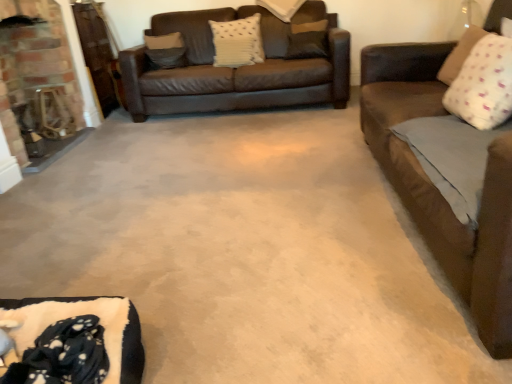
Locate an element on the screen. This screenshot has width=512, height=384. suede-like beige pillow at upper left, which is the 6th pillow from right to left is located at coordinates click(x=166, y=50).

You are a GUI agent. You are given a task and a screenshot of the screen. Output one action in this format:
    pyautogui.click(x=<x>, y=<y>)
    Task: Click on the brown fabric pillow at upper center, the fourth pillow when ordered from left to right
    
    Given the screenshot: What is the action you would take?
    click(308, 40)

Measure the distance between brown fabric pillow at upper center, the fourth pillow from the front, and camera.

The depth of brown fabric pillow at upper center, the fourth pillow from the front, is 11.60 feet.

Where is `white dotted pillow at upper right, the 6th pillow positioned from the left`? white dotted pillow at upper right, the 6th pillow positioned from the left is located at coordinates (460, 54).

What do you see at coordinates (63, 55) in the screenshot? I see `brick fireplace at left` at bounding box center [63, 55].

This screenshot has width=512, height=384. What do you see at coordinates (132, 350) in the screenshot?
I see `black fleece blanket at lower left` at bounding box center [132, 350].

You are a GUI agent. You are given a task and a screenshot of the screen. Output one action in this format:
    pyautogui.click(x=<x>, y=<y>)
    Task: Click on the suede-like beige pillow at upper left, which is the 6th pillow from right to left
    The image size is (512, 384).
    Given the screenshot: What is the action you would take?
    pyautogui.click(x=166, y=50)

Between white soft pillow at upper right, which ranks as the 1th pillow in front-to-back order, and white dotted pillow at upper right, marked as the 5th pillow in a back-to-front arrangement, which one has more height?

With more height is white soft pillow at upper right, which ranks as the 1th pillow in front-to-back order.

Is white soft pillow at upper right, acting as the 6th pillow starting from the back, turned away from white dotted pillow at upper right, marked as the 5th pillow in a back-to-front arrangement?

That's not correct — white soft pillow at upper right, acting as the 6th pillow starting from the back, is not looking away from white dotted pillow at upper right, marked as the 5th pillow in a back-to-front arrangement.

Is the position of white soft pillow at upper right, which ranks as the 2th pillow in right-to-left order, more distant than that of white dotted pillow at upper right, the 6th pillow positioned from the left?

No.

Based on their sizes in the image, would you say white soft pillow at upper right, the fifth pillow positioned from the left, is bigger or smaller than white dotted pillow at upper right, acting as the second pillow starting from the front?

Clearly, white soft pillow at upper right, the fifth pillow positioned from the left, is larger in size than white dotted pillow at upper right, acting as the second pillow starting from the front.

Is white textured pillow at upper center, the fourth pillow viewed from the right, at the right side of suede-like beige pillow at upper left, the 6th pillow viewed from the front?

Yes, white textured pillow at upper center, the fourth pillow viewed from the right, is to the right of suede-like beige pillow at upper left, the 6th pillow viewed from the front.

How many degrees apart are the facing directions of white textured pillow at upper center, arranged as the 2th pillow when viewed from the back, and suede-like beige pillow at upper left, which is the first pillow from back to front?

8.65 degrees.

Is white textured pillow at upper center, the third pillow viewed from the left, beside suede-like beige pillow at upper left, which is the 6th pillow from right to left?

No, white textured pillow at upper center, the third pillow viewed from the left, is not next to suede-like beige pillow at upper left, which is the 6th pillow from right to left.

From the image's perspective, would you say white textured pillow at upper center, the third pillow viewed from the left, is positioned over suede-like beige pillow at upper left, which is the 6th pillow from right to left?

Yes.

Is there a large distance between brick fireplace at left and white textured pillow at center, positioned as the fourth pillow in back-to-front order?

brick fireplace at left is far away from white textured pillow at center, positioned as the fourth pillow in back-to-front order.

At what (x,y) coordinates should I click in order to perform the action: click on the 2nd pillow to the right of the brick fireplace at left, starting your count from the anchor. Please return your answer as a coordinate pair (x, y). The image size is (512, 384). Looking at the image, I should click on (237, 42).

Between point (42, 81) and point (244, 19), which one is positioned behind?

The point (244, 19) is more distant.

Do you think brick fireplace at left is within white textured pillow at center, the 3th pillow viewed from the front, or outside of it?

brick fireplace at left exists outside the volume of white textured pillow at center, the 3th pillow viewed from the front.

Considering the positions of objects white dotted pillow at upper right, the 6th pillow positioned from the left, and black fleece blanket at lower left in the image provided, who is behind, white dotted pillow at upper right, the 6th pillow positioned from the left, or black fleece blanket at lower left?

white dotted pillow at upper right, the 6th pillow positioned from the left, is further from the camera.

Who is shorter, white dotted pillow at upper right, acting as the second pillow starting from the front, or black fleece blanket at lower left?

Standing shorter between the two is black fleece blanket at lower left.

How distant is white dotted pillow at upper right, acting as the second pillow starting from the front, from black fleece blanket at lower left?

They are 2.15 meters apart.

Does point (469, 31) lie behind point (136, 380)?

That is True.

From the image's perspective, is white soft pillow at upper right, which ranks as the 2th pillow in right-to-left order, above brown fabric pillow at upper center, which appears as the third pillow when viewed from the right?

Incorrect, from the image's perspective, white soft pillow at upper right, which ranks as the 2th pillow in right-to-left order, is lower than brown fabric pillow at upper center, which appears as the third pillow when viewed from the right.

Considering the relative sizes of white soft pillow at upper right, acting as the 6th pillow starting from the back, and brown fabric pillow at upper center, which is counted as the 3th pillow, starting from the back, in the image provided, is white soft pillow at upper right, acting as the 6th pillow starting from the back, smaller than brown fabric pillow at upper center, which is counted as the 3th pillow, starting from the back,?

Actually, white soft pillow at upper right, acting as the 6th pillow starting from the back, might be larger than brown fabric pillow at upper center, which is counted as the 3th pillow, starting from the back.

From the image's perspective, which pillow is the 3rd one below the brown fabric pillow at upper center, which appears as the third pillow when viewed from the right? Please provide its 2D coordinates.

[(483, 84)]

From a real-world perspective, which object rests below the other?

white soft pillow at upper right, which ranks as the 1th pillow in front-to-back order, is physically lower.

From a real-world perspective, is suede-like beige pillow at upper left, acting as the 1th pillow starting from the left, located higher than white soft pillow at upper right, which ranks as the 1th pillow in front-to-back order?

Actually, suede-like beige pillow at upper left, acting as the 1th pillow starting from the left, is physically below white soft pillow at upper right, which ranks as the 1th pillow in front-to-back order, in the real world.

In the scene shown: Which object is positioned more to the right, suede-like beige pillow at upper left, which is the first pillow from back to front, or white soft pillow at upper right, which ranks as the 1th pillow in front-to-back order?

Positioned to the right is white soft pillow at upper right, which ranks as the 1th pillow in front-to-back order.

Where is `the 5th pillow in front of the suede-like beige pillow at upper left, the 6th pillow viewed from the front`? the 5th pillow in front of the suede-like beige pillow at upper left, the 6th pillow viewed from the front is located at coordinates (483, 84).

Considering the relative sizes of suede-like beige pillow at upper left, which is the 6th pillow from right to left, and white soft pillow at upper right, which ranks as the 2th pillow in right-to-left order, in the image provided, is suede-like beige pillow at upper left, which is the 6th pillow from right to left, shorter than white soft pillow at upper right, which ranks as the 2th pillow in right-to-left order,?

Yes, suede-like beige pillow at upper left, which is the 6th pillow from right to left, is shorter than white soft pillow at upper right, which ranks as the 2th pillow in right-to-left order.

Visually, is white dotted pillow at upper right, the 6th pillow positioned from the left, positioned to the left or to the right of white soft pillow at upper right, acting as the 6th pillow starting from the back?

Based on their positions, white dotted pillow at upper right, the 6th pillow positioned from the left, is located to the right of white soft pillow at upper right, acting as the 6th pillow starting from the back.

In order to click on the 2nd pillow directly above the white dotted pillow at upper right, marked as the 5th pillow in a back-to-front arrangement (from a real-world perspective) in this screenshot , I will do `click(483, 84)`.

From their relative heights in the image, would you say white dotted pillow at upper right, the 6th pillow positioned from the left, is taller or shorter than white soft pillow at upper right, acting as the 6th pillow starting from the back?

Clearly, white dotted pillow at upper right, the 6th pillow positioned from the left, is shorter compared to white soft pillow at upper right, acting as the 6th pillow starting from the back.

Is white dotted pillow at upper right, the 6th pillow positioned from the left, not close to white soft pillow at upper right, acting as the 6th pillow starting from the back?

No, white dotted pillow at upper right, the 6th pillow positioned from the left, is in close proximity to white soft pillow at upper right, acting as the 6th pillow starting from the back.

From a real-world perspective, which pillow is the 2nd one underneath the white soft pillow at upper right, acting as the 6th pillow starting from the back? Please provide its 2D coordinates.

[(460, 54)]

Identify the location of pillow that is the 1st one when counting downward from the white textured pillow at upper center, the third pillow viewed from the left (from the image's perspective). This screenshot has width=512, height=384. (166, 50).

When comparing their distances from black fleece blanket at lower left, does white textured pillow at upper center, arranged as the 2th pillow when viewed from the back, or brown fabric pillow at upper center, which appears as the third pillow when viewed from the right, seem further?

white textured pillow at upper center, arranged as the 2th pillow when viewed from the back, lies further to black fleece blanket at lower left than the other object.

Based on their spatial positions, is black fleece blanket at lower left or white textured pillow at upper center, placed as the 5th pillow when sorted from front to back, further from white soft pillow at upper right, which ranks as the 2th pillow in right-to-left order?

Among the two, white textured pillow at upper center, placed as the 5th pillow when sorted from front to back, is located further to white soft pillow at upper right, which ranks as the 2th pillow in right-to-left order.

Looking at the image, which one is located further to brick fireplace at left, white dotted pillow at upper right, the 6th pillow positioned from the left, or white textured pillow at upper center, the third pillow viewed from the left?

white dotted pillow at upper right, the 6th pillow positioned from the left.

Estimate the real-world distances between objects in this image. Which object is further from white textured pillow at center, the 3th pillow viewed from the front, white soft pillow at upper right, the fifth pillow positioned from the left, or suede-like beige pillow at upper left, which is the first pillow from back to front?

The object further to white textured pillow at center, the 3th pillow viewed from the front, is white soft pillow at upper right, the fifth pillow positioned from the left.

When comparing their distances from brown fabric pillow at upper center, which appears as the third pillow when viewed from the right, does white textured pillow at upper center, the third pillow viewed from the left, or suede-like beige pillow at upper left, the 6th pillow viewed from the front, seem closer?

white textured pillow at upper center, the third pillow viewed from the left, lies closer to brown fabric pillow at upper center, which appears as the third pillow when viewed from the right, than the other object.

Estimate the real-world distances between objects in this image. Which object is further from white textured pillow at center, the 5th pillow when ordered from right to left, brick fireplace at left or black fleece blanket at lower left?

The object further to white textured pillow at center, the 5th pillow when ordered from right to left, is black fleece blanket at lower left.

From the image, which object appears to be farther from white textured pillow at center, the 3th pillow viewed from the front, suede-like beige pillow at upper left, which is the 6th pillow from right to left, or white textured pillow at upper center, placed as the 5th pillow when sorted from front to back?

Based on the image, suede-like beige pillow at upper left, which is the 6th pillow from right to left, appears to be further to white textured pillow at center, the 3th pillow viewed from the front.

Which object lies nearer to the anchor point white textured pillow at upper center, placed as the 5th pillow when sorted from front to back, suede-like beige pillow at upper left, acting as the 1th pillow starting from the left, or brick fireplace at left?

suede-like beige pillow at upper left, acting as the 1th pillow starting from the left.

What are the coordinates of `pillow between suede-like beige pillow at upper left, the 6th pillow viewed from the front, and white textured pillow at upper center, arranged as the 2th pillow when viewed from the back, from left to right` in the screenshot? It's located at (237, 42).

You are a GUI agent. You are given a task and a screenshot of the screen. Output one action in this format:
    pyautogui.click(x=<x>, y=<y>)
    Task: Click on the fireplace positioned between black fleece blanket at lower left and white textured pillow at center, marked as the second pillow in a left-to-right arrangement, from near to far
    This screenshot has height=384, width=512.
    Given the screenshot: What is the action you would take?
    pyautogui.click(x=63, y=55)

The height and width of the screenshot is (384, 512). What are the coordinates of `fireplace between black fleece blanket at lower left and brown fabric pillow at upper center, which is counted as the 3th pillow, starting from the back, along the z-axis` in the screenshot? It's located at (63, 55).

Find the location of a particular element. This screenshot has width=512, height=384. pillow located between white dotted pillow at upper right, the first pillow when ordered from right to left, and brown fabric pillow at upper center, the fourth pillow from the front, in the depth direction is located at coordinates (237, 42).